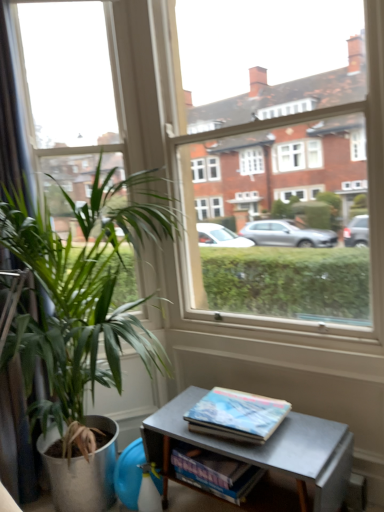
This screenshot has width=384, height=512. What do you see at coordinates (215, 472) in the screenshot?
I see `blue glossy book at lower center` at bounding box center [215, 472].

Locate an element on the screen. green leafy plant at left is located at coordinates (82, 298).

In order to click on metallic gray table at lower right in this screenshot , I will do pyautogui.click(x=263, y=449).

Image resolution: width=384 pixels, height=512 pixels. Describe the element at coordinates (237, 415) in the screenshot. I see `hardcover book at lower right` at that location.

Find the location of a particular element. blue glossy book at lower center is located at coordinates (215, 472).

In the image, there is a metallic gray table at lower right. Where is `curtain above it (from the image's perspective)`? The height and width of the screenshot is (512, 384). curtain above it (from the image's perspective) is located at coordinates (16, 438).

Are metallic gray table at lower right and black fabric curtain at left far apart?

Yes.

Is metallic gray table at lower right taller than black fabric curtain at left?

Incorrect, the height of metallic gray table at lower right is not larger of that of black fabric curtain at left.

From the image's perspective, would you say metallic gray table at lower right is shown under black fabric curtain at left?

Indeed, from the image's perspective, metallic gray table at lower right is shown beneath black fabric curtain at left.

Is green leafy plant at left at the right side of hardcover book at lower right?

In fact, green leafy plant at left is to the left of hardcover book at lower right.

Is point (66, 261) positioned in front of point (272, 426)?

That is False.

Relative to hardcover book at lower right, is green leafy plant at left in front or behind?

Clearly, green leafy plant at left is in front of hardcover book at lower right.

From the image's perspective, is hardcover book at lower right located above blue glossy book at lower center?

Yes, from the image's perspective, hardcover book at lower right is above blue glossy book at lower center.

Does hardcover book at lower right have a greater height compared to blue glossy book at lower center?

Incorrect, the height of hardcover book at lower right is not larger of that of blue glossy book at lower center.

From the picture: Is hardcover book at lower right not close to blue glossy book at lower center?

Actually, hardcover book at lower right and blue glossy book at lower center are a little close together.

From a real-world perspective, is hardcover book at lower right physically located above or below blue glossy book at lower center?

Clearly, from a real-world perspective, hardcover book at lower right is above blue glossy book at lower center.

Between clear glass window at center and black fabric curtain at left, which one has smaller size?

black fabric curtain at left.

Which object is closer to the camera taking this photo, clear glass window at center or black fabric curtain at left?

clear glass window at center.

Could you tell me if clear glass window at center is facing black fabric curtain at left?

No, clear glass window at center is not turned towards black fabric curtain at left.

I want to click on houseplant below the clear glass window at center (from the image's perspective), so click(82, 298).

Measure the distance from green leafy plant at left to clear glass window at center.

A distance of 35.19 centimeters exists between green leafy plant at left and clear glass window at center.

Considering the positions of objects green leafy plant at left and clear glass window at center in the image provided, who is in front, green leafy plant at left or clear glass window at center?

green leafy plant at left is more forward.

Considering the sizes of objects green leafy plant at left and clear glass window at center in the image provided, who is wider, green leafy plant at left or clear glass window at center?

With larger width is green leafy plant at left.

Does hardcover book at lower right appear on the left side of black fabric curtain at left?

Incorrect, hardcover book at lower right is not on the left side of black fabric curtain at left.

From a real-world perspective, is hardcover book at lower right beneath black fabric curtain at left?

Yes, from a real-world perspective, hardcover book at lower right is below black fabric curtain at left.

Considering the relative sizes of hardcover book at lower right and black fabric curtain at left in the image provided, is hardcover book at lower right taller than black fabric curtain at left?

No.

Considering the positions of points (351, 455) and (203, 456), is point (351, 455) closer to camera compared to point (203, 456)?

No, it is behind (203, 456).

From a real-world perspective, is metallic gray table at lower right above or below blue glossy book at lower center?

metallic gray table at lower right is situated lower than blue glossy book at lower center in the real world.

Does metallic gray table at lower right have a lesser height compared to blue glossy book at lower center?

No, metallic gray table at lower right is not shorter than blue glossy book at lower center.

In terms of width, does metallic gray table at lower right look wider or thinner when compared to blue glossy book at lower center?

Clearly, metallic gray table at lower right has more width compared to blue glossy book at lower center.

At what (x,y) coordinates should I click in order to perform the action: click on table below the black fabric curtain at left (from a real-world perspective). Please return your answer as a coordinate pair (x, y). The image size is (384, 512). Looking at the image, I should click on (263, 449).

There is a hardcover book at lower right. Where is `houseplant above it (from a real-world perspective)`? The image size is (384, 512). houseplant above it (from a real-world perspective) is located at coordinates click(82, 298).

Based on their spatial positions, is hardcover book at lower right or green leafy plant at left further from blue glossy book at lower center?

The object further to blue glossy book at lower center is green leafy plant at left.

Based on their spatial positions, is blue glossy book at lower center or green leafy plant at left closer to black fabric curtain at left?

green leafy plant at left is closer to black fabric curtain at left.

Looking at the image, which one is located further to hardcover book at lower right, green leafy plant at left or black fabric curtain at left?

Based on the image, black fabric curtain at left appears to be further to hardcover book at lower right.

Consider the image. Considering their positions, is black fabric curtain at left positioned closer to blue glossy book at lower center than metallic gray table at lower right?

metallic gray table at lower right is closer to blue glossy book at lower center.

Considering their positions, is black fabric curtain at left positioned closer to green leafy plant at left than hardcover book at lower right?

Based on the image, hardcover book at lower right appears to be nearer to green leafy plant at left.

Looking at the image, which one is located further to black fabric curtain at left, hardcover book at lower right or metallic gray table at lower right?

Based on the image, metallic gray table at lower right appears to be further to black fabric curtain at left.

Considering their positions, is green leafy plant at left positioned closer to clear glass window at center than metallic gray table at lower right?

green leafy plant at left is closer to clear glass window at center.

Looking at the image, which one is located closer to green leafy plant at left, black fabric curtain at left or blue glossy book at lower center?

Based on the image, black fabric curtain at left appears to be nearer to green leafy plant at left.

You are a GUI agent. You are given a task and a screenshot of the screen. Output one action in this format:
    pyautogui.click(x=<x>, y=<y>)
    Task: Click on the book located between green leafy plant at left and metallic gray table at lower right in the left-right direction
    The width and height of the screenshot is (384, 512).
    Given the screenshot: What is the action you would take?
    pyautogui.click(x=237, y=415)

The height and width of the screenshot is (512, 384). Identify the location of magazine located between black fabric curtain at left and metallic gray table at lower right in the left-right direction. (215, 472).

Image resolution: width=384 pixels, height=512 pixels. I want to click on book between clear glass window at center and blue glossy book at lower center vertically, so (x=237, y=415).

The height and width of the screenshot is (512, 384). Identify the location of houseplant between clear glass window at center and metallic gray table at lower right vertically. (82, 298).